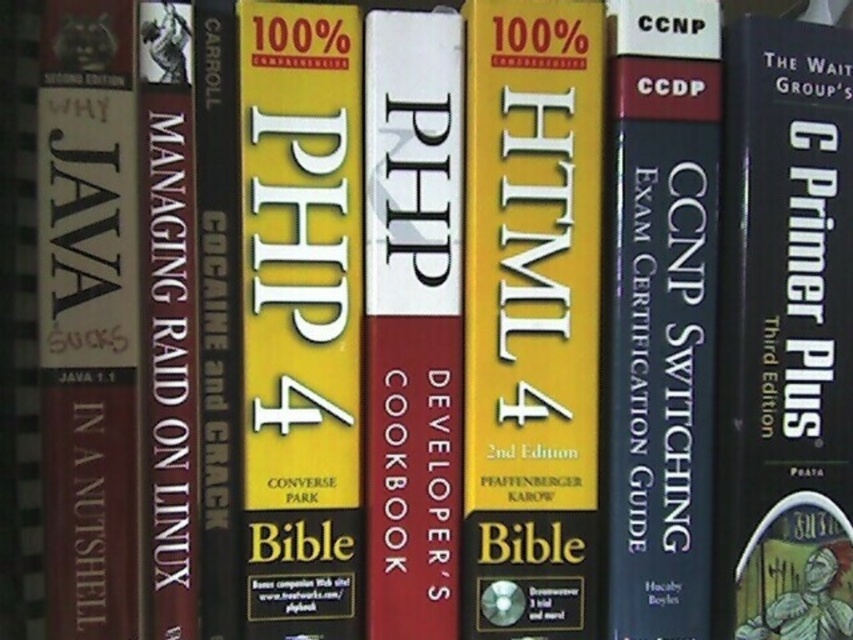
Between yellow matte/html book at center and black hardcover book at center, which one has less height?

yellow matte/html book at center

Consider the image. Is yellow matte/html book at center positioned behind black hardcover book at center?

No, yellow matte/html book at center is in front of black hardcover book at center.

Who is more forward, (495, 188) or (624, 465)?

Positioned in front is point (495, 188).

This screenshot has width=853, height=640. Find the location of `yellow matte/html book at center`. yellow matte/html book at center is located at coordinates (531, 317).

Does black hardcover book at center have a smaller size compared to white matte php developer's cookbook at center?

No, black hardcover book at center is not smaller than white matte php developer's cookbook at center.

Which is more to the right, black hardcover book at center or white matte php developer's cookbook at center?

black hardcover book at center

Locate an element on the screen. black hardcover book at center is located at coordinates (660, 314).

You are a GUI agent. You are given a task and a screenshot of the screen. Output one action in this format:
    pyautogui.click(x=<x>, y=<y>)
    Task: Click on the black hardcover book at center
    This screenshot has width=853, height=640.
    Given the screenshot: What is the action you would take?
    pyautogui.click(x=660, y=314)

Who is higher up, yellow matte book at center or black hardcover book at center?

Positioned higher is black hardcover book at center.

Between point (297, 291) and point (633, 588), which one is positioned behind?

Positioned behind is point (633, 588).

Is point (285, 182) behind point (619, 611)?

That is False.

Locate an element on the screen. yellow matte book at center is located at coordinates (300, 317).